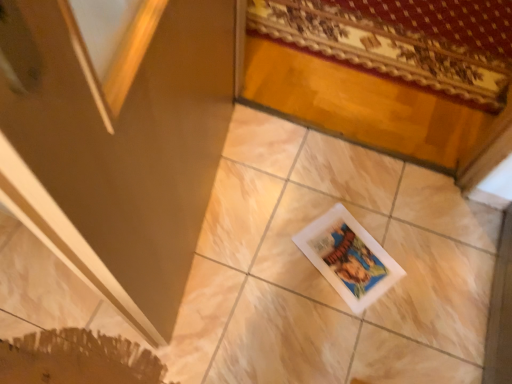
Identify the location of vacant area that lies between matte brown screen door at lower left and white matte picture frame at center. The image size is (512, 384). (272, 238).